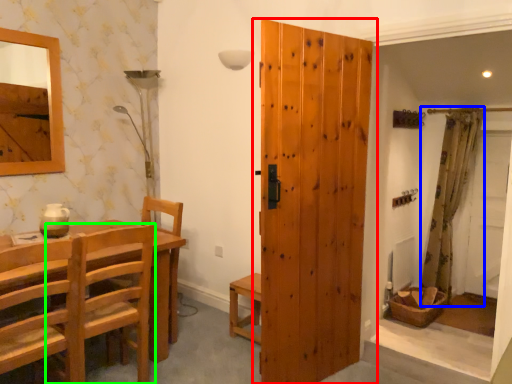
Question: Considering the real-world distances, which object is farthest from door (highlighted by a red box)? curtain (highlighted by a blue box) or chair (highlighted by a green box)?

Choices:
 (A) curtain
 (B) chair

Answer: (A)